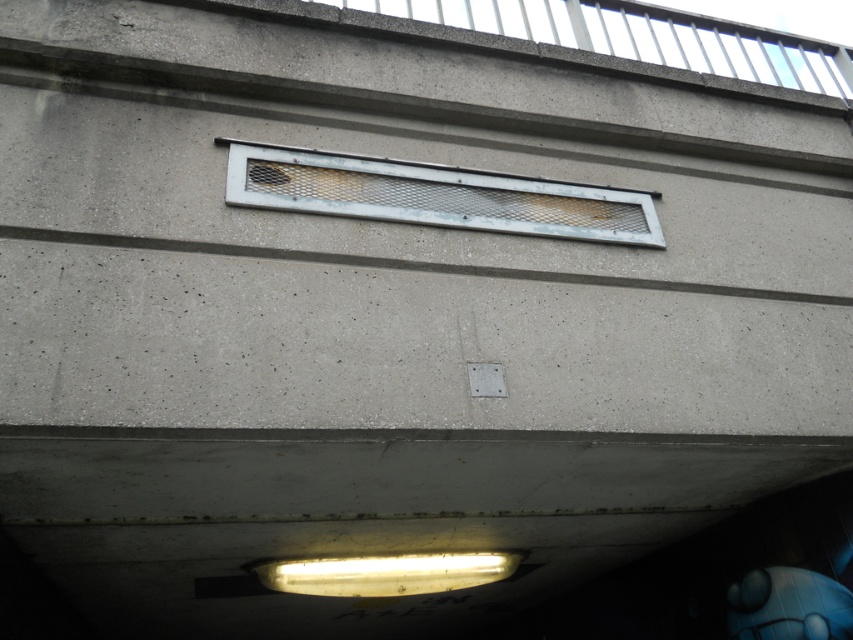
Question: Where is metal mesh vent at center located in relation to metal mesh vent at upper center in the image?

Choices:
 (A) above
 (B) below

Answer: (B)

Question: Which point is closer to the camera taking this photo?

Choices:
 (A) (448, 225)
 (B) (614, 36)

Answer: (A)

Question: Does metal mesh vent at center appear on the right side of metal mesh vent at upper center?

Choices:
 (A) no
 (B) yes

Answer: (A)

Question: Which object is closer to the camera taking this photo?

Choices:
 (A) metal mesh vent at center
 (B) metal mesh vent at upper center

Answer: (A)

Question: Is metal mesh vent at center smaller than metal mesh vent at upper center?

Choices:
 (A) no
 (B) yes

Answer: (B)